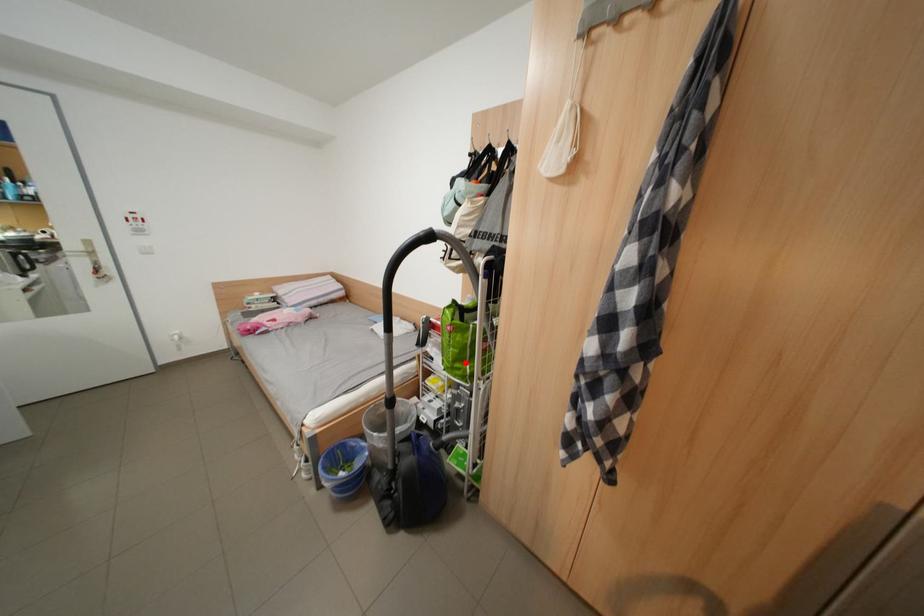
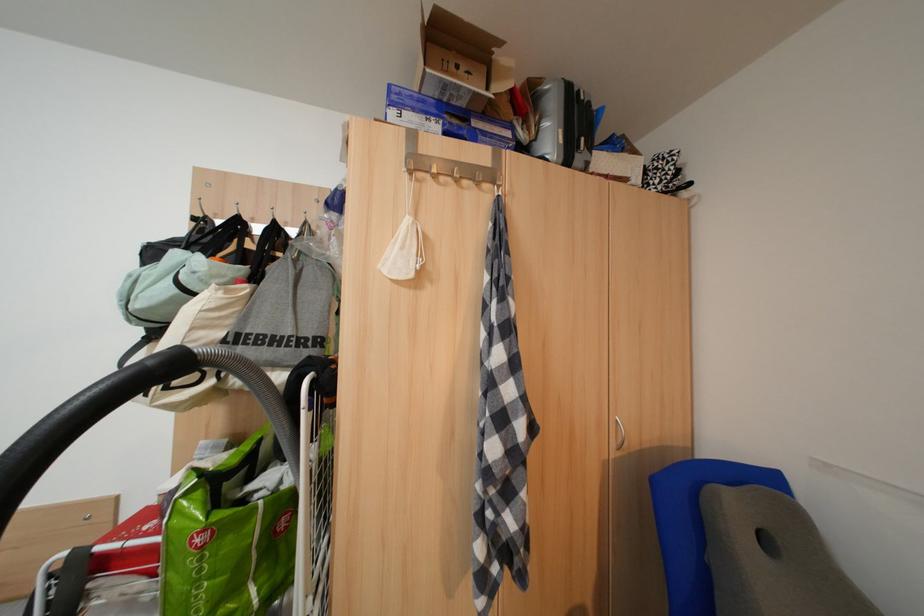
Question: I am providing you with two images of the same scene from different viewpoints. In image1, a red point is highlighted. Considering the same 3D point in image2, which of the following is correct?

Choices:
 (A) It is closer
 (B) It is farther

Answer: (A)